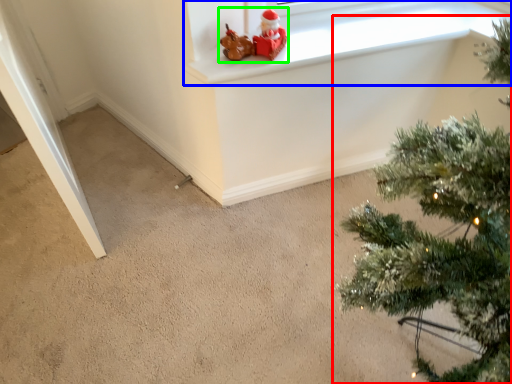
Question: Which is nearer to the christmas tree (highlighted by a red box)? window frame (highlighted by a blue box) or toy (highlighted by a green box).

Choices:
 (A) window frame
 (B) toy

Answer: (A)